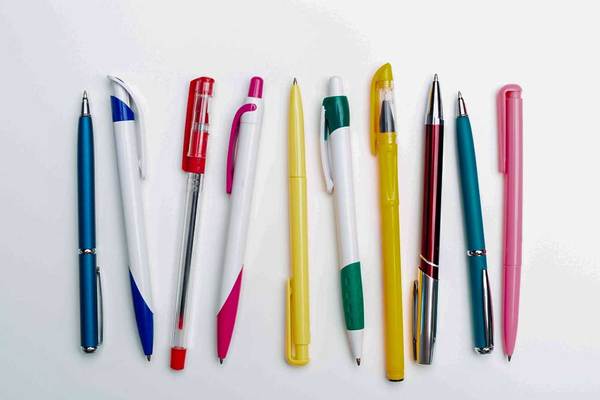
Where is `pens`? pens is located at coordinates (517, 227), (483, 280), (434, 284), (392, 260), (346, 265), (306, 282), (234, 294), (191, 269), (136, 287), (91, 311).